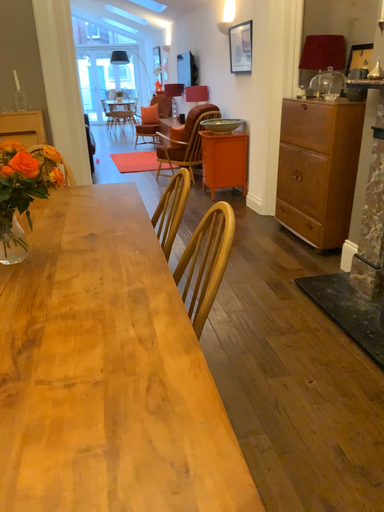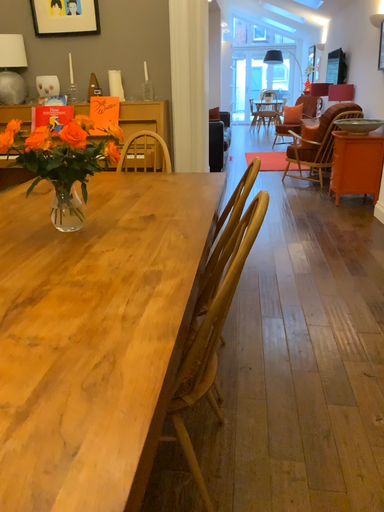
Question: How did the camera likely rotate when shooting the video?

Choices:
 (A) rotated right
 (B) rotated left

Answer: (B)